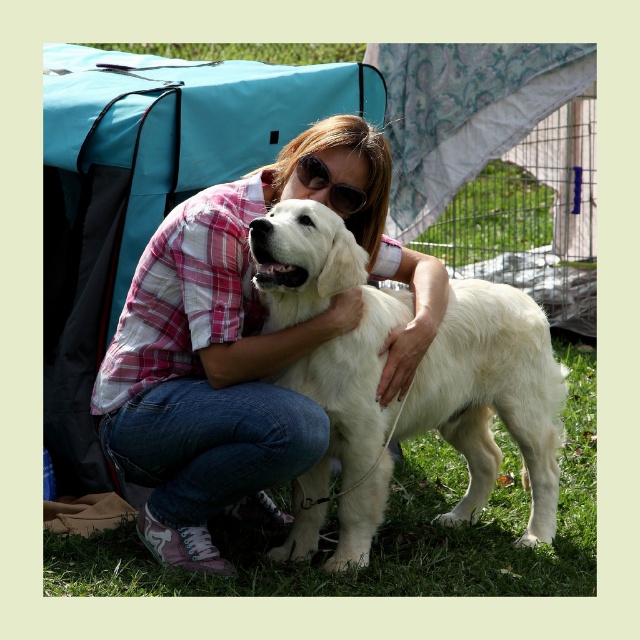
Is pink plaid shirt at center closer to camera compared to white fluffy dog at center?

No, it is not.

Can you confirm if pink plaid shirt at center is taller than white fluffy dog at center?

Yes, pink plaid shirt at center is taller than white fluffy dog at center.

The width and height of the screenshot is (640, 640). What do you see at coordinates (241, 349) in the screenshot?
I see `pink plaid shirt at center` at bounding box center [241, 349].

This screenshot has width=640, height=640. Find the location of `pink plaid shirt at center`. pink plaid shirt at center is located at coordinates (241, 349).

Which is above, pink plaid shirt at center or sunglasses at center?

sunglasses at center is higher up.

Is pink plaid shirt at center taller than sunglasses at center?

Yes.

What do you see at coordinates (241, 349) in the screenshot? I see `pink plaid shirt at center` at bounding box center [241, 349].

You are a GUI agent. You are given a task and a screenshot of the screen. Output one action in this format:
    pyautogui.click(x=<x>, y=<y>)
    Task: Click on the pink plaid shirt at center
    
    Given the screenshot: What is the action you would take?
    pyautogui.click(x=241, y=349)

Identify the location of white fluffy dog at center. (410, 385).

Between point (440, 333) and point (320, 184), which one is positioned in front?

Point (320, 184) is in front.

You are a GUI agent. You are given a task and a screenshot of the screen. Output one action in this format:
    pyautogui.click(x=<x>, y=<y>)
    Task: Click on the white fluffy dog at center
    Image resolution: width=640 pixels, height=640 pixels.
    Given the screenshot: What is the action you would take?
    pyautogui.click(x=410, y=385)